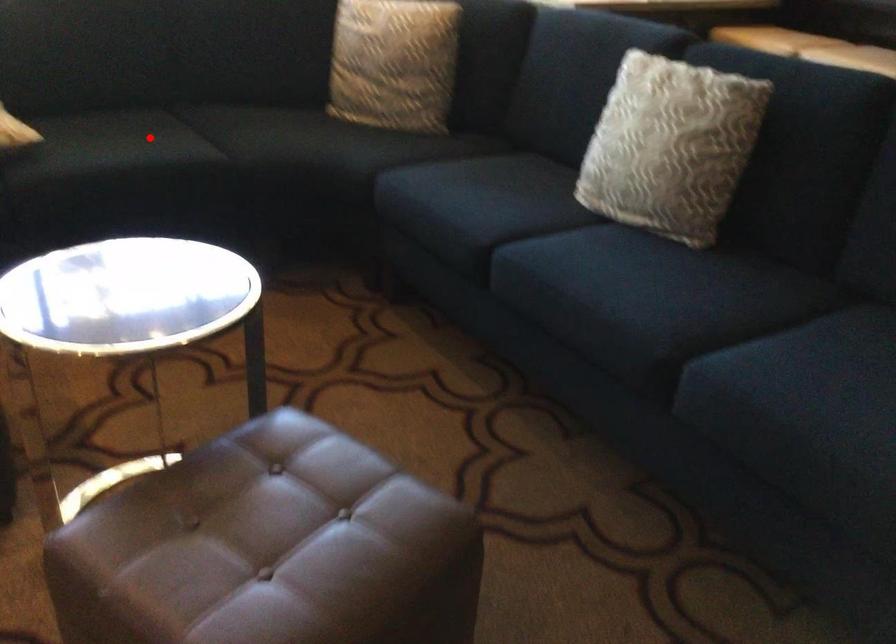
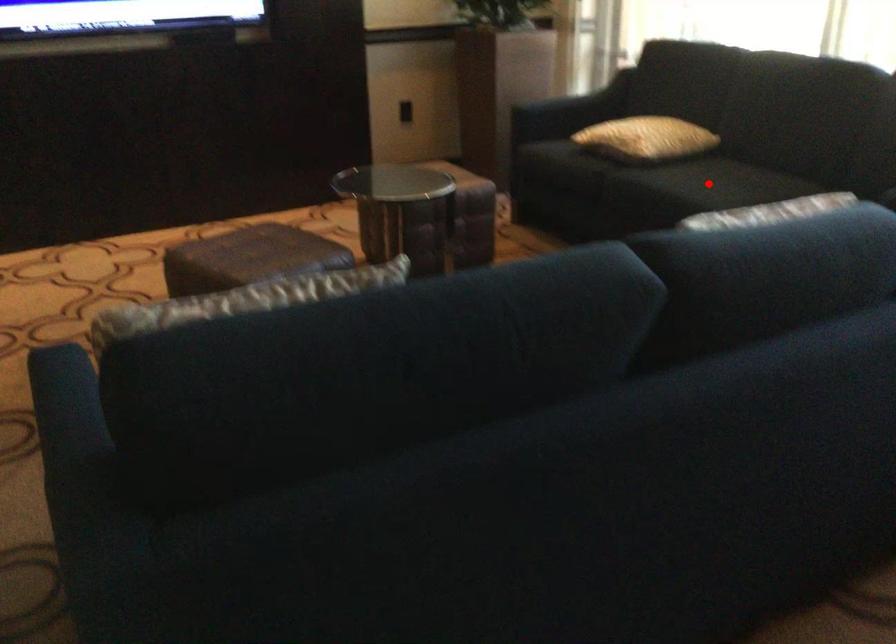
I am providing you with two images of the same scene from different viewpoints. A red point is marked on the first image and another point is marked on the second image. Is the marked point in image1 the same physical position as the marked point in image2?

Yes